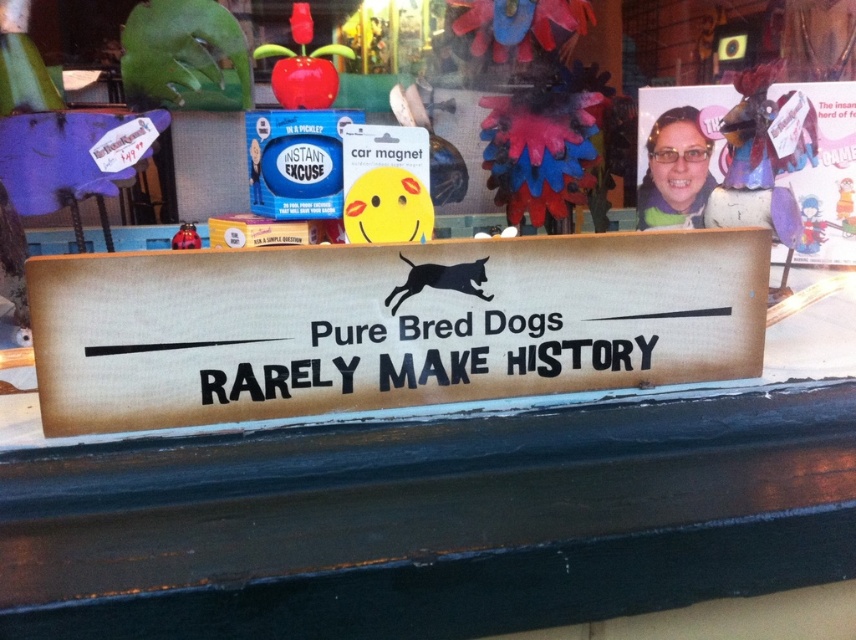
You are standing in front of the storefront window display. There are two points marked on the window at coordinates point [724,90] and point [266,400]. If you were to draw a straight line from your eye level to each point, which point would appear closer to you?

Point [266,400] would appear closer because it is in front of point [724,90] according to their positions.

Based on the scene description, what object is located at the coordinates point [387,324]?

The wooden signboard at center is located at point [387,324].